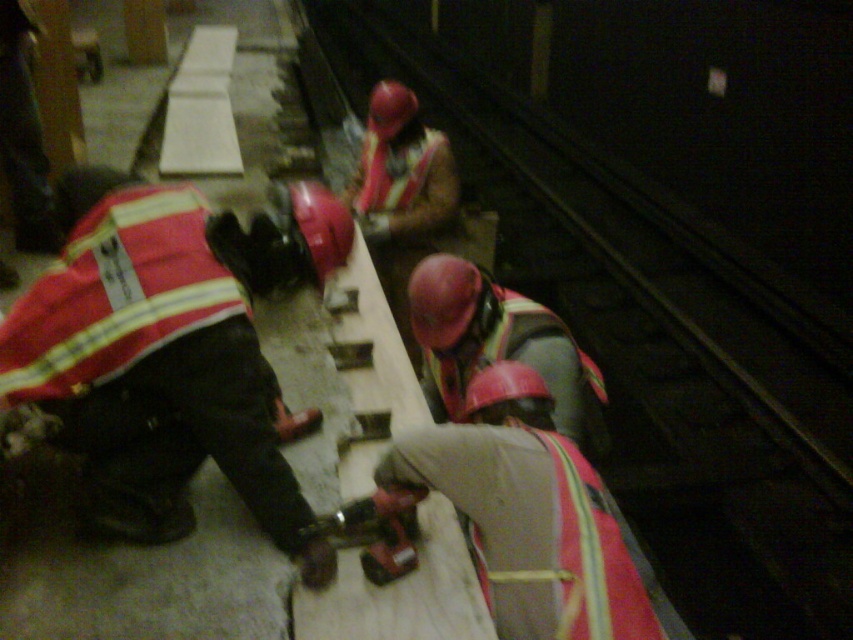
Between point (364, 561) and point (419, 289), which one is positioned behind?

The point (419, 289) is more distant.

This screenshot has width=853, height=640. What do you see at coordinates (531, 515) in the screenshot? I see `red hard hat at center` at bounding box center [531, 515].

You are a GUI agent. You are given a task and a screenshot of the screen. Output one action in this format:
    pyautogui.click(x=<x>, y=<y>)
    Task: Click on the red hard hat at center
    This screenshot has width=853, height=640.
    Given the screenshot: What is the action you would take?
    pyautogui.click(x=531, y=515)

Which is above, reflective safety vest at lower left or red hard hat at center?

reflective safety vest at lower left

Is reflective safety vest at lower left above red hard hat at center?

Yes.

Find the location of a particular element. The width and height of the screenshot is (853, 640). reflective safety vest at lower left is located at coordinates (169, 349).

Is the position of reflective safety vest at lower left less distant than that of matte red hard hat at center?

That is True.

Can you confirm if reflective safety vest at lower left is thinner than matte red hard hat at center?

In fact, reflective safety vest at lower left might be wider than matte red hard hat at center.

In order to click on reflective safety vest at lower left in this screenshot , I will do point(169,349).